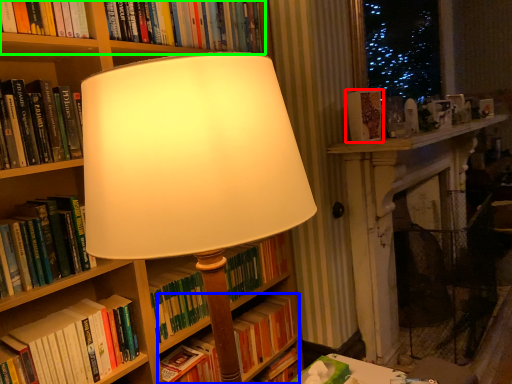
Question: Considering the real-world distances, which object is closest to book (highlighted by a red box)? book (highlighted by a blue box) or book (highlighted by a green box).

Choices:
 (A) book
 (B) book

Answer: (B)